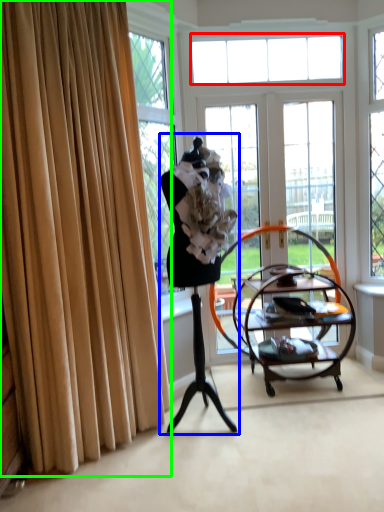
Question: Estimate the real-world distances between objects in this image. Which object is closer to window (highlighted by a red box), woman (highlighted by a blue box) or curtain (highlighted by a green box)?

Choices:
 (A) woman
 (B) curtain

Answer: (A)